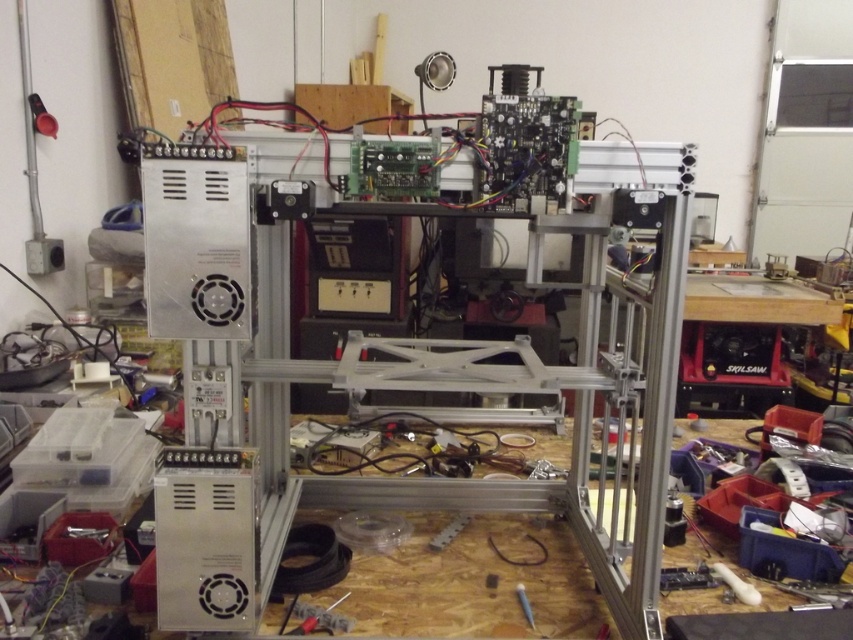
Is white plastic tool at lower right smaller than metallic silver screwdriver at center?

No.

Between white plastic tool at lower right and metallic silver screwdriver at center, which one has less height?

metallic silver screwdriver at center

Is point (753, 588) farther from camera compared to point (520, 595)?

Yes, it is.

This screenshot has height=640, width=853. Identify the location of white plastic tool at lower right. (735, 584).